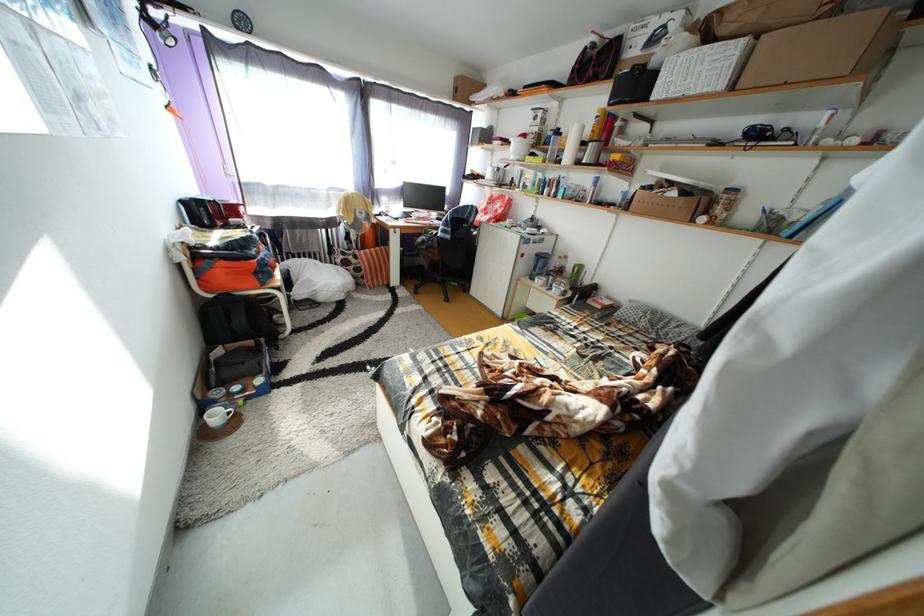
The height and width of the screenshot is (616, 924). What do you see at coordinates (229, 408) in the screenshot?
I see `the white mug handle` at bounding box center [229, 408].